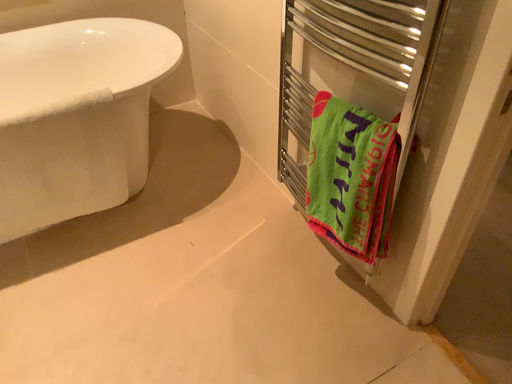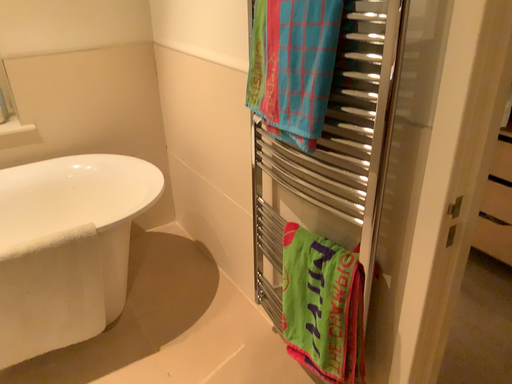
Question: How did the camera likely rotate when shooting the video?

Choices:
 (A) rotated upward
 (B) rotated downward

Answer: (A)